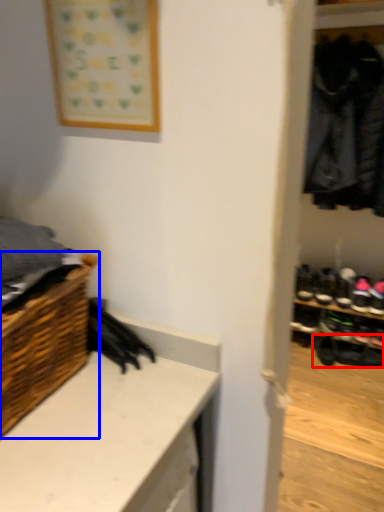
Question: Which of the following is the closest to the observer, footwear (highlighted by a red box) or shelf (highlighted by a blue box)?

Choices:
 (A) footwear
 (B) shelf

Answer: (B)